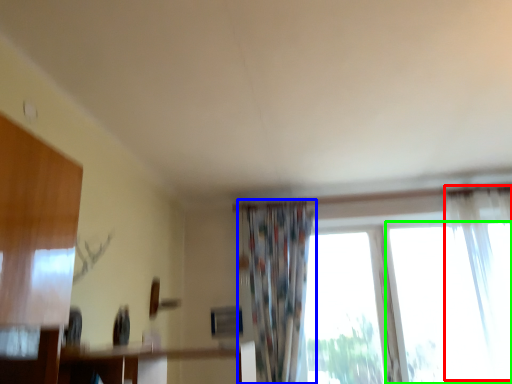
Question: Considering the real-world distances, which object is closest to curtain (highlighted by a red box)? curtain (highlighted by a blue box) or window (highlighted by a green box).

Choices:
 (A) curtain
 (B) window

Answer: (B)